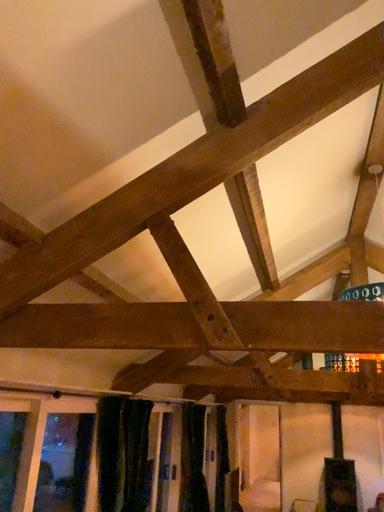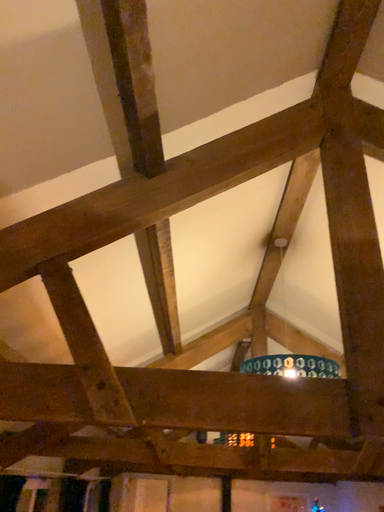
Question: Which way did the camera rotate in the video?

Choices:
 (A) rotated upward
 (B) rotated downward

Answer: (A)